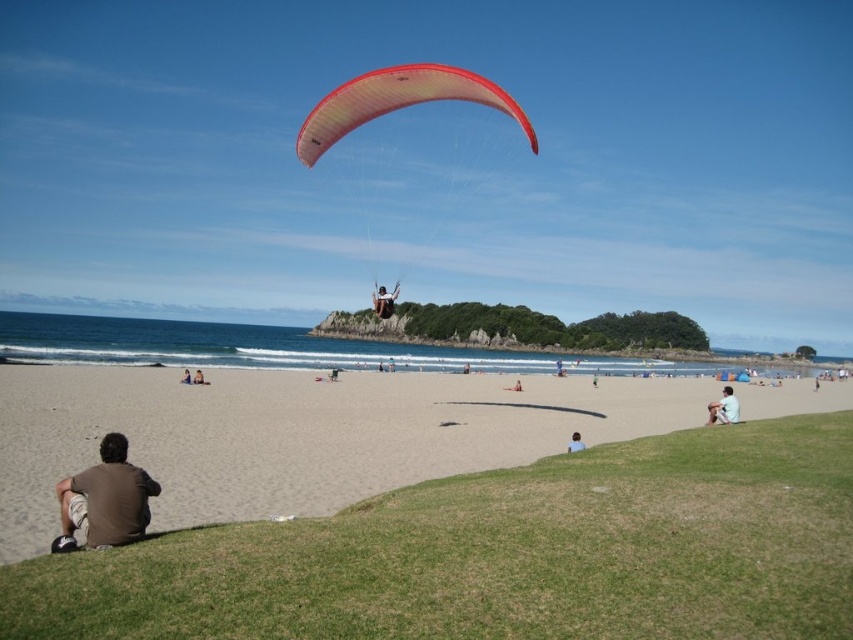
Is beige sand at lower center closer to camera compared to blue fabric person at lower center?

Yes, it is.

Does point (387, 384) come farther from viewer compared to point (572, 445)?

That is True.

At what (x,y) coordinates should I click in order to perform the action: click on beige sand at lower center. Please return your answer as a coordinate pair (x, y). Looking at the image, I should click on (297, 435).

Which is below, matte black backpack at center or blue fabric person at lower center?

Positioned lower is blue fabric person at lower center.

Can you confirm if matte black backpack at center is positioned above blue fabric person at lower center?

Yes.

This screenshot has width=853, height=640. What do you see at coordinates (384, 301) in the screenshot?
I see `matte black backpack at center` at bounding box center [384, 301].

Identify the location of matte black backpack at center. (384, 301).

Does brown fabric person at center appear over blue denim shorts at center?

Incorrect, brown fabric person at center is not positioned above blue denim shorts at center.

Does point (200, 381) come in front of point (187, 380)?

Yes, point (200, 381) is in front of point (187, 380).

Where is `brown fabric person at center`? This screenshot has height=640, width=853. brown fabric person at center is located at coordinates (198, 378).